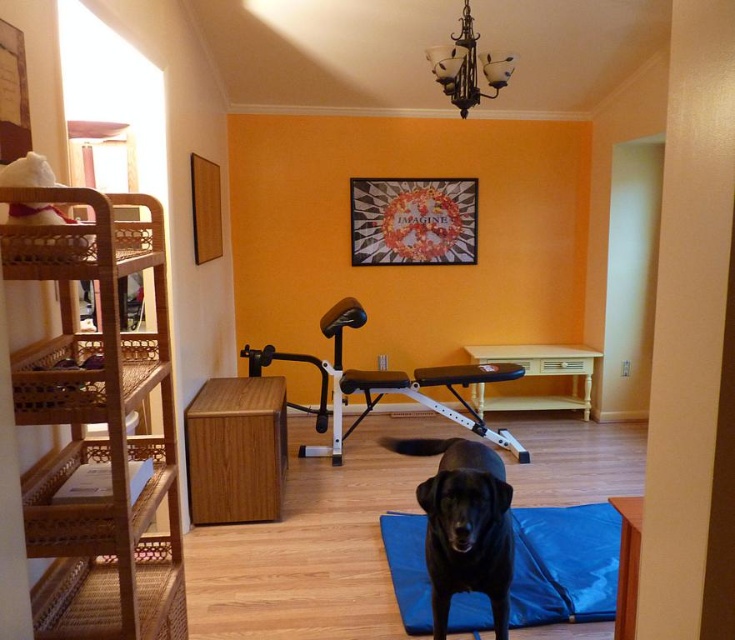
Question: Which object is the closest to the blue fabric yoga mat at center?

Choices:
 (A) wooden bunk bed at center
 (B) woven wood bunk bed at left

Answer: (A)

Question: Is black matte dog at center behind wooden bunk bed at center?

Choices:
 (A) yes
 (B) no

Answer: (B)

Question: Can you confirm if woven wood bunk bed at left is wider than wooden bunk bed at center?

Choices:
 (A) yes
 (B) no

Answer: (B)

Question: Observing the image, what is the correct spatial positioning of woven wood bunk bed at left in reference to wooden bunk bed at center?

Choices:
 (A) right
 (B) left

Answer: (B)

Question: Which object is farther from the camera taking this photo?

Choices:
 (A) black matte dog at center
 (B) blue fabric yoga mat at center
 (C) woven wood bunk bed at left
 (D) wooden bunk bed at center

Answer: (D)

Question: Which object is positioned farthest from the black matte dog at center?

Choices:
 (A) wooden bunk bed at center
 (B) woven wood bunk bed at left

Answer: (A)